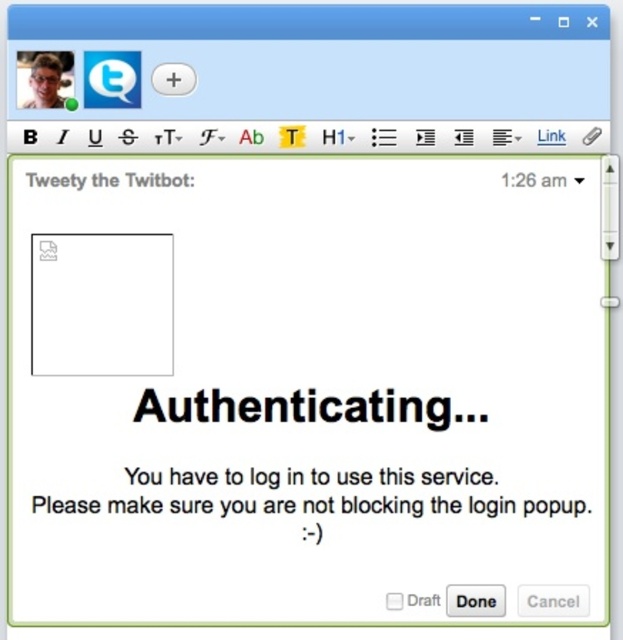
Find the location of a particular element. This screenshot has width=623, height=640. white matte square at upper left is located at coordinates tap(102, 305).

Consider the image. Measure the distance between point (143, 364) and camera.

Point (143, 364) is 1.42 meters away from camera.

You are a GUI agent. You are given a task and a screenshot of the screen. Output one action in this format:
    pyautogui.click(x=<x>, y=<y>)
    Task: Click on the white matte square at upper left
    The image size is (623, 640).
    Given the screenshot: What is the action you would take?
    pyautogui.click(x=102, y=305)

Who is more forward, (110,300) or (227,419)?

Positioned in front is point (110,300).

Is white matte square at upper left wider than black text at center?

Incorrect, white matte square at upper left's width does not surpass black text at center's.

Between point (32, 272) and point (229, 419), which one is positioned behind?

The point (229, 419) is more distant.

The width and height of the screenshot is (623, 640). I want to click on white matte square at upper left, so click(102, 305).

Who is lower down, black text at center or black matte text at center?

Positioned lower is black matte text at center.

Does black text at center have a smaller size compared to black matte text at center?

Correct, black text at center occupies less space than black matte text at center.

The height and width of the screenshot is (640, 623). What do you see at coordinates (302, 408) in the screenshot?
I see `black text at center` at bounding box center [302, 408].

Identify the location of black text at center. The image size is (623, 640). (302, 408).